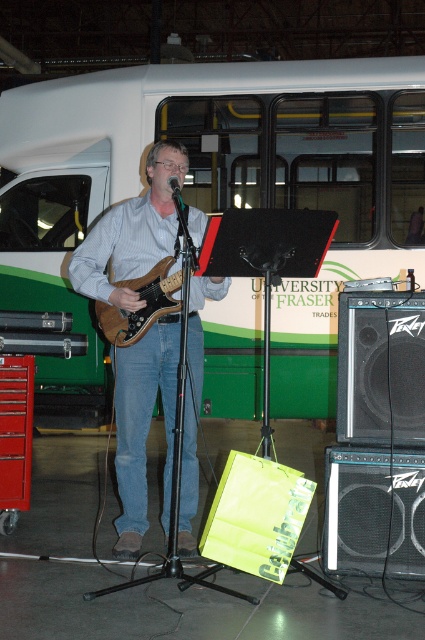
You are a stagehand setting up for a performance. The brown wood guitar at center needs to be placed exactly 15 feet away from the microphone stand. Based on the current setup, is the guitar within the required distance?

The brown wood guitar at center is currently 14.62 feet away from the microphone stand, which is within the required 15 feet distance.